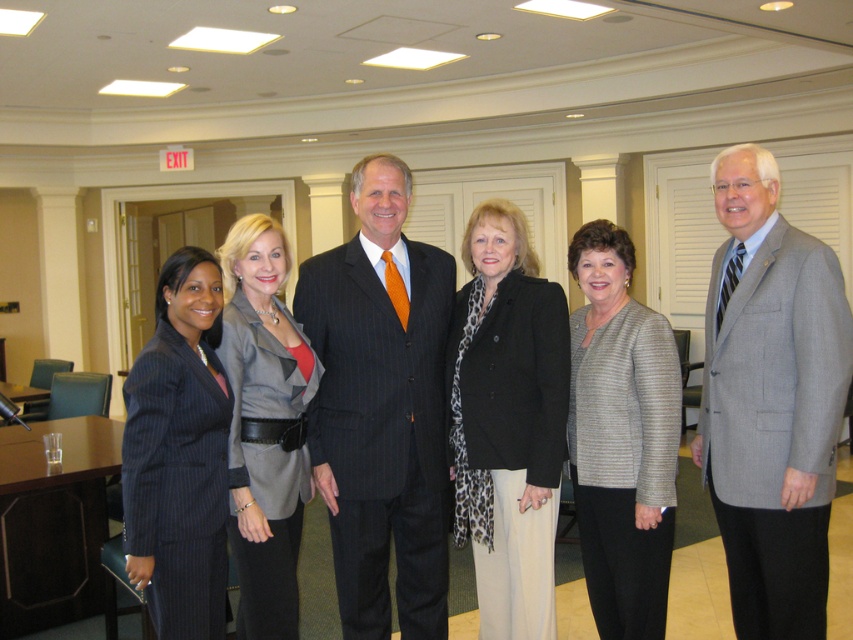
Can you confirm if gray pinstripe suit at center is positioned below gray textured blazer at center?

Incorrect, gray pinstripe suit at center is not positioned below gray textured blazer at center.

Is gray pinstripe suit at center to the left of gray textured blazer at center from the viewer's perspective?

No, gray pinstripe suit at center is not to the left of gray textured blazer at center.

Between point (741, 529) and point (265, 618), which one is positioned behind?

The point (741, 529) is more distant.

This screenshot has width=853, height=640. Find the location of `gray pinstripe suit at center`. gray pinstripe suit at center is located at coordinates (770, 401).

Is point (431, 413) farther from viewer compared to point (630, 276)?

No, it is not.

Who is shorter, pinstripe suit at center or textured gray blazer at center?

Standing shorter between the two is textured gray blazer at center.

Between point (390, 180) and point (621, 296), which one is positioned behind?

Positioned behind is point (621, 296).

The height and width of the screenshot is (640, 853). Identify the location of pinstripe suit at center. (381, 408).

Does point (720, 268) lie behind point (656, 323)?

That is True.

Between point (805, 314) and point (642, 556), which one is positioned behind?

Point (642, 556)

Measure the distance between point (844,314) and camera.

Point (844,314) and camera are 2.64 meters apart from each other.

What are the coordinates of `gray pinstripe suit at center` in the screenshot? It's located at (770, 401).